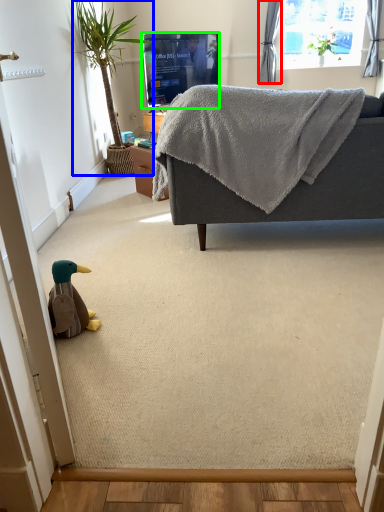
Question: Which is farther away from curtain (highlighted by a red box)? houseplant (highlighted by a blue box) or television (highlighted by a green box)?

Choices:
 (A) houseplant
 (B) television

Answer: (A)